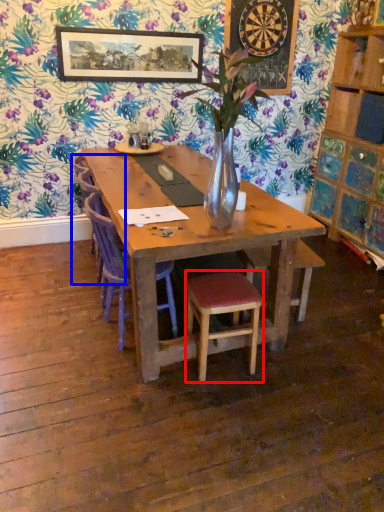
Question: Among these objects, which one is farthest to the camera, stool (highlighted by a red box) or armchair (highlighted by a blue box)?

Choices:
 (A) stool
 (B) armchair

Answer: (B)